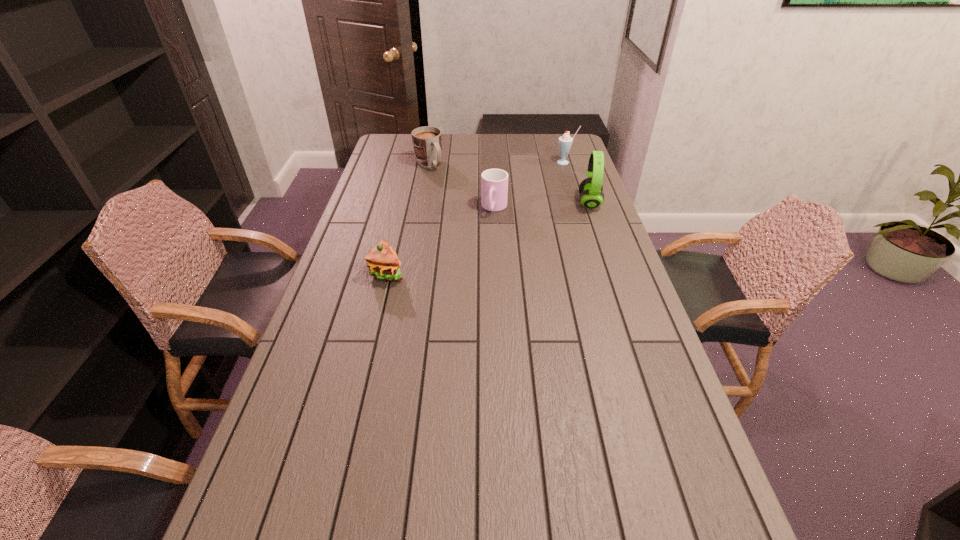
You are a GUI agent. You are given a task and a screenshot of the screen. Output one action in this format:
    pyautogui.click(x=<x>, y=<y>)
    Task: Click on the sandwich
    This screenshot has height=540, width=960.
    Given the screenshot: What is the action you would take?
    pyautogui.click(x=383, y=263)

Locate an element on the screen. The height and width of the screenshot is (540, 960). headset is located at coordinates (591, 193).

Where is `the third object from left to right`? This screenshot has width=960, height=540. the third object from left to right is located at coordinates (494, 182).

I want to click on milkshake, so click(x=565, y=141).

This screenshot has height=540, width=960. I want to click on mug, so click(x=427, y=141).

Locate an element on the screen. The image size is (960, 540). vacant space located 0.090m on the front of the sandwich is located at coordinates (378, 309).

Find the location of a particular element. This screenshot has width=960, height=540. vacant space located 0.240m on the front of the headset is located at coordinates (608, 256).

Locate an element on the screen. This screenshot has height=540, width=960. vacant space positioned with the handle on the side of the third object from left to right is located at coordinates (478, 259).

Where is `free spot located 0.100m with the handle on the side of the third object from left to right`? Image resolution: width=960 pixels, height=540 pixels. free spot located 0.100m with the handle on the side of the third object from left to right is located at coordinates (487, 234).

Locate an element on the screen. This screenshot has width=960, height=540. free spot located with the handle on the side of the third object from left to right is located at coordinates (489, 230).